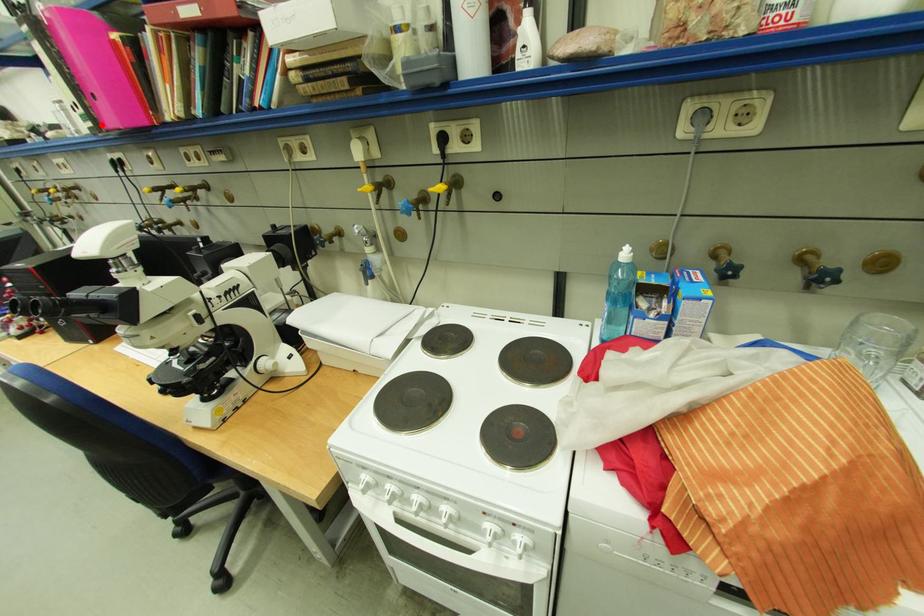
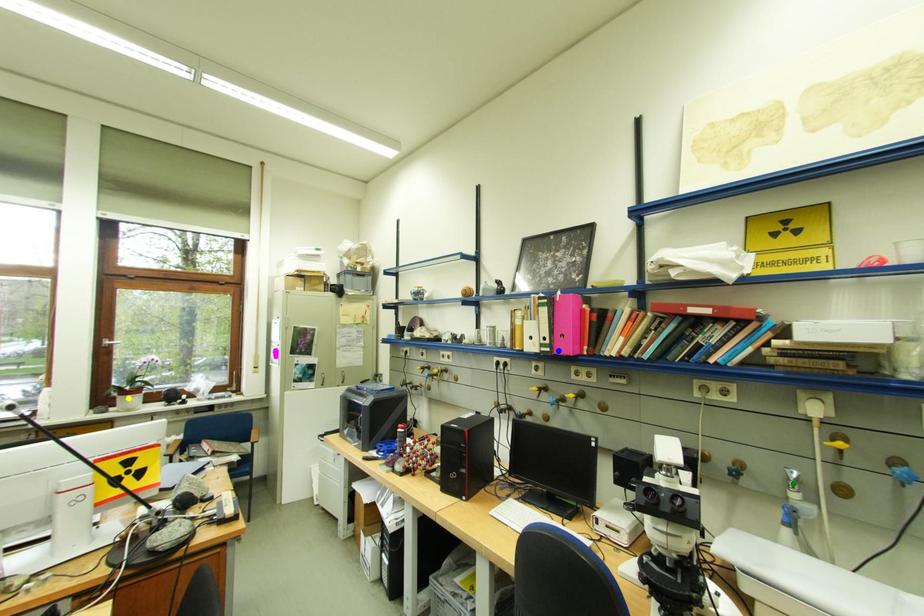
Question: I am providing you with two images of the same scene from different viewpoints. A red point is marked on the first image. You are given multiple points on the second image. In image 2, which mark is for the same physical point as the one in image 1?

Choices:
 (A) green point
 (B) yellow point
 (C) blue point

Answer: (C)